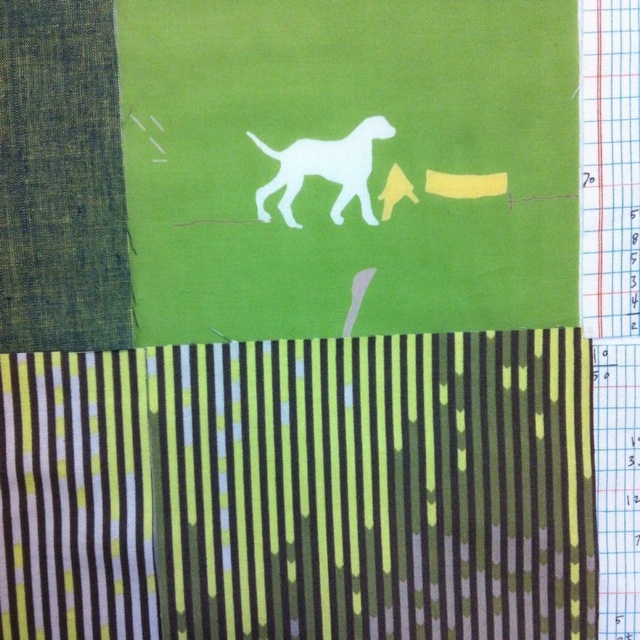
Is green striped fabric at lower center above white matte dog at center?

Incorrect, green striped fabric at lower center is not positioned above white matte dog at center.

Does point (74, 573) come farther from viewer compared to point (300, 157)?

No, (74, 573) is in front of (300, 157).

Is point (173, 438) more distant than point (372, 225)?

No, it is in front of (372, 225).

Locate an element on the screen. The image size is (640, 640). green striped fabric at lower center is located at coordinates (300, 490).

Which is above, white paper dog at center or white matte dog at center?

white paper dog at center

Is point (422, 92) closer to viewer compared to point (371, 145)?

Yes, it is.

Does point (316, 259) lie behind point (346, 138)?

Yes, it is behind point (346, 138).

Image resolution: width=640 pixels, height=640 pixels. In order to click on white paper dog at center in this screenshot , I will do `click(348, 164)`.

Does point (337, 413) come behind point (333, 253)?

Yes, point (337, 413) is farther from viewer.

Based on the photo, which of these two, green striped fabric at lower center or white paper dog at center, stands shorter?

Standing shorter between the two is green striped fabric at lower center.

Where is `green striped fabric at lower center`? The width and height of the screenshot is (640, 640). green striped fabric at lower center is located at coordinates (300, 490).